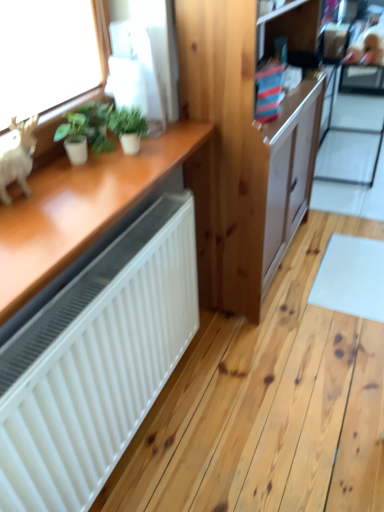
What is the approximate width of natural wood cabinet at center?

13.08 inches.

In order to face green matte plant at upper left, which is the first houseplant from left to right, should I rotate leftwards or rightwards?

Turn left by 15.567 degrees to look at green matte plant at upper left, which is the first houseplant from left to right.

Based on the photo, measure the distance between point [377,158] and camera.

Point [377,158] and camera are 10.38 feet apart from each other.

Locate an element on the screen. This screenshot has width=384, height=512. green matte plant at upper left, arranged as the 2th houseplant when viewed from the left is located at coordinates (127, 127).

Considering the sizes of white matte figurine at left and green matte plant at upper left, arranged as the 2th houseplant when viewed from the left, in the image, is white matte figurine at left wider or thinner than green matte plant at upper left, arranged as the 2th houseplant when viewed from the left,?

In the image, white matte figurine at left appears to be more narrow than green matte plant at upper left, arranged as the 2th houseplant when viewed from the left.

Considering the relative sizes of white matte figurine at left and green matte plant at upper left, arranged as the 2th houseplant when viewed from the left, in the image provided, is white matte figurine at left taller than green matte plant at upper left, arranged as the 2th houseplant when viewed from the left,?

Indeed, white matte figurine at left has a greater height compared to green matte plant at upper left, arranged as the 2th houseplant when viewed from the left.

Is white matte figurine at left spatially inside green matte plant at upper left, arranged as the 2th houseplant when viewed from the left, or outside of it?

white matte figurine at left lies outside green matte plant at upper left, arranged as the 2th houseplant when viewed from the left.

Are white matte figurine at left and green matte plant at upper left, placed as the 1th houseplant when sorted from right to left, far apart?

They are positioned close to each other.

Which object is closer to the camera taking this photo, transparent glass screen door at upper right or white matte figurine at left?

white matte figurine at left.

Locate an element on the screen. The width and height of the screenshot is (384, 512). screen door that appears below the white matte figurine at left (from a real-world perspective) is located at coordinates (349, 132).

Is white matte figurine at left at the back of transparent glass screen door at upper right?

No, transparent glass screen door at upper right's orientation is not away from white matte figurine at left.

Does point (335, 126) appear closer or farther from the camera than point (18, 123)?

Point (335, 126).

Is transparent glass screen door at upper right behind green matte plant at upper left, placed as the 1th houseplant when sorted from right to left?

Yes, it is.

From a real-world perspective, relative to green matte plant at upper left, arranged as the 2th houseplant when viewed from the left, is transparent glass screen door at upper right vertically above or below?

From a real-world perspective, transparent glass screen door at upper right is physically below green matte plant at upper left, arranged as the 2th houseplant when viewed from the left.

Does transparent glass screen door at upper right have a greater width compared to green matte plant at upper left, arranged as the 2th houseplant when viewed from the left?

Indeed, transparent glass screen door at upper right has a greater width compared to green matte plant at upper left, arranged as the 2th houseplant when viewed from the left.

How many degrees apart are the facing directions of transparent glass screen door at upper right and green matte plant at upper left, placed as the 1th houseplant when sorted from right to left?

The angular difference between transparent glass screen door at upper right and green matte plant at upper left, placed as the 1th houseplant when sorted from right to left, is 0.4 degrees.

From the image's perspective, who appears lower, green matte plant at upper left, which is the first houseplant from left to right, or white matte figurine at left?

white matte figurine at left, from the image's perspective.

Is green matte plant at upper left, the second houseplant in the right-to-left sequence, looking in the opposite direction of white matte figurine at left?

No, green matte plant at upper left, the second houseplant in the right-to-left sequence, is not facing the opposite direction of white matte figurine at left.

Can you confirm if green matte plant at upper left, the second houseplant in the right-to-left sequence, is bigger than white matte figurine at left?

Incorrect, green matte plant at upper left, the second houseplant in the right-to-left sequence, is not larger than white matte figurine at left.

Would you consider green matte plant at upper left, which is the first houseplant from left to right, to be distant from white matte figurine at left?

No, green matte plant at upper left, which is the first houseplant from left to right, is in close proximity to white matte figurine at left.

Between transparent glass screen door at upper right and natural wood cabinet at center, which one appears on the right side from the viewer's perspective?

Positioned to the right is transparent glass screen door at upper right.

Which is closer to the camera, [331,102] or [201,275]?

The point [201,275] is closer.

From a real-world perspective, is transparent glass screen door at upper right located beneath natural wood cabinet at center?

Yes, from a real-world perspective, transparent glass screen door at upper right is beneath natural wood cabinet at center.

In the scene shown: Considering the sizes of transparent glass screen door at upper right and natural wood cabinet at center in the image, is transparent glass screen door at upper right wider or thinner than natural wood cabinet at center?

Clearly, transparent glass screen door at upper right has more width compared to natural wood cabinet at center.

From the picture: Is green matte plant at upper left, which is the first houseplant from left to right, outside of transparent glass screen door at upper right?

Indeed, green matte plant at upper left, which is the first houseplant from left to right, is completely outside transparent glass screen door at upper right.

Is green matte plant at upper left, the second houseplant in the right-to-left sequence, at the left side of transparent glass screen door at upper right?

Correct, you'll find green matte plant at upper left, the second houseplant in the right-to-left sequence, to the left of transparent glass screen door at upper right.

Does point (86, 128) lie in front of point (363, 182)?

Yes, it is in front of point (363, 182).

From a real-world perspective, between transparent glass screen door at upper right and green matte plant at upper left, the second houseplant in the right-to-left sequence, who is vertically higher?

green matte plant at upper left, the second houseplant in the right-to-left sequence.

Which of these two, transparent glass screen door at upper right or green matte plant at upper left, the second houseplant in the right-to-left sequence, is thinner?

green matte plant at upper left, the second houseplant in the right-to-left sequence.

Is transparent glass screen door at upper right placed right next to green matte plant at upper left, which is the first houseplant from left to right?

transparent glass screen door at upper right is not next to green matte plant at upper left, which is the first houseplant from left to right, and they're not touching.

Can green matte plant at upper left, the second houseplant in the right-to-left sequence, be found inside transparent glass screen door at upper right?

Definitely not — green matte plant at upper left, the second houseplant in the right-to-left sequence, is not inside transparent glass screen door at upper right.

Identify the location of houseplant that is the 2nd object to the right of the white matte figurine at left, starting at the anchor. This screenshot has height=512, width=384. (127, 127).

The width and height of the screenshot is (384, 512). Identify the location of screen door above the white matte figurine at left (from the image's perspective). (349, 132).

From the image, which object appears to be nearer to green matte plant at upper left, arranged as the 2th houseplant when viewed from the left, transparent glass screen door at upper right or green matte plant at upper left, the second houseplant in the right-to-left sequence?

The object closer to green matte plant at upper left, arranged as the 2th houseplant when viewed from the left, is green matte plant at upper left, the second houseplant in the right-to-left sequence.

When comparing their distances from transparent glass screen door at upper right, does green matte plant at upper left, arranged as the 2th houseplant when viewed from the left, or green matte plant at upper left, the second houseplant in the right-to-left sequence, seem further?

green matte plant at upper left, the second houseplant in the right-to-left sequence, lies further to transparent glass screen door at upper right than the other object.

Based on their spatial positions, is white matte figurine at left or green matte plant at upper left, which is the first houseplant from left to right, further from green matte plant at upper left, placed as the 1th houseplant when sorted from right to left?

Among the two, white matte figurine at left is located further to green matte plant at upper left, placed as the 1th houseplant when sorted from right to left.

Based on their spatial positions, is green matte plant at upper left, arranged as the 2th houseplant when viewed from the left, or transparent glass screen door at upper right closer to white matte figurine at left?

green matte plant at upper left, arranged as the 2th houseplant when viewed from the left.

Which object lies nearer to the anchor point natural wood cabinet at center, green matte plant at upper left, arranged as the 2th houseplant when viewed from the left, or white matte figurine at left?

Among the two, green matte plant at upper left, arranged as the 2th houseplant when viewed from the left, is located nearer to natural wood cabinet at center.

Based on their spatial positions, is natural wood cabinet at center or green matte plant at upper left, placed as the 1th houseplant when sorted from right to left, closer to transparent glass screen door at upper right?

Among the two, natural wood cabinet at center is located nearer to transparent glass screen door at upper right.

Which object lies nearer to the anchor point green matte plant at upper left, which is the first houseplant from left to right, transparent glass screen door at upper right or green matte plant at upper left, arranged as the 2th houseplant when viewed from the left?

green matte plant at upper left, arranged as the 2th houseplant when viewed from the left, is positioned closer to the anchor green matte plant at upper left, which is the first houseplant from left to right.

Considering their positions, is green matte plant at upper left, arranged as the 2th houseplant when viewed from the left, positioned further to white matte figurine at left than natural wood cabinet at center?

The object further to white matte figurine at left is natural wood cabinet at center.

Where is `cabinetry between green matte plant at upper left, which is the first houseplant from left to right, and transparent glass screen door at upper right`? This screenshot has height=512, width=384. cabinetry between green matte plant at upper left, which is the first houseplant from left to right, and transparent glass screen door at upper right is located at coordinates (236, 154).

Locate an element on the screen. The image size is (384, 512). cabinetry positioned between green matte plant at upper left, arranged as the 2th houseplant when viewed from the left, and transparent glass screen door at upper right from near to far is located at coordinates (236, 154).

The image size is (384, 512). I want to click on houseplant located between white matte figurine at left and green matte plant at upper left, placed as the 1th houseplant when sorted from right to left, in the depth direction, so click(x=85, y=131).

Where is `houseplant between green matte plant at upper left, which is the first houseplant from left to right, and natural wood cabinet at center`? This screenshot has width=384, height=512. houseplant between green matte plant at upper left, which is the first houseplant from left to right, and natural wood cabinet at center is located at coordinates (127, 127).